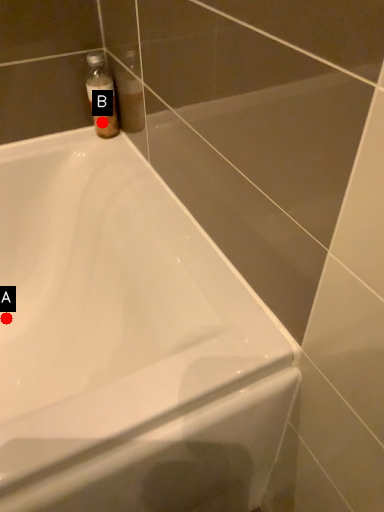
Question: Two points are circled on the image, labeled by A and B beside each circle. Which point appears farthest from the camera in this image?

Choices:
 (A) A is further
 (B) B is further

Answer: (A)